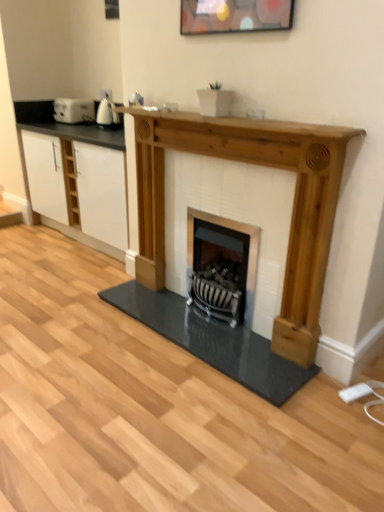
I want to click on wooden shelf at center, so click(65, 125).

What are the coordinates of `natural wood fireplace at center` in the screenshot? It's located at (238, 282).

Identify the location of white glossy kettle at upper left, arranged as the first appliance when viewed from the right. This screenshot has width=384, height=512. (107, 113).

Where is `wooden shelf at center`? The width and height of the screenshot is (384, 512). wooden shelf at center is located at coordinates (65, 125).

Can we say white glossy kettle at upper left, the second appliance when ordered from back to front, lies outside white plastic toaster at left, which ranks as the second appliance in right-to-left order?

Yes.

Between white glossy kettle at upper left, the second appliance when ordered from back to front, and white plastic toaster at left, which is the 1th appliance from left to right, which one has more height?

Standing taller between the two is white glossy kettle at upper left, the second appliance when ordered from back to front.

From the image's perspective, is white glossy kettle at upper left, the 1th appliance positioned from the front, under white plastic toaster at left, which is the 1th appliance from left to right?

Indeed, from the image's perspective, white glossy kettle at upper left, the 1th appliance positioned from the front, is shown beneath white plastic toaster at left, which is the 1th appliance from left to right.

Image resolution: width=384 pixels, height=512 pixels. Identify the location of appliance below the white glossy kettle at upper left, the second appliance when ordered from back to front (from a real-world perspective). (74, 110).

Is white glossy kettle at upper left, the second appliance when ordered from back to front, wider than natural wood fireplace at center?

No.

Which object is further away from the camera taking this photo, white glossy kettle at upper left, arranged as the first appliance when viewed from the right, or natural wood fireplace at center?

Positioned behind is white glossy kettle at upper left, arranged as the first appliance when viewed from the right.

Based on the photo, is white glossy kettle at upper left, positioned as the 2th appliance in left-to-right order, taller or shorter than natural wood fireplace at center?

Clearly, white glossy kettle at upper left, positioned as the 2th appliance in left-to-right order, is shorter compared to natural wood fireplace at center.

Are white glossy kettle at upper left, the second appliance when ordered from back to front, and natural wood fireplace at center far apart?

Indeed, white glossy kettle at upper left, the second appliance when ordered from back to front, is not near natural wood fireplace at center.

How far apart are white plastic toaster at left, which ranks as the second appliance in right-to-left order, and natural wood fireplace at center?

They are 1.86 meters apart.

Is white plastic toaster at left, which is the 1th appliance from left to right, wider or thinner than natural wood fireplace at center?

In the image, white plastic toaster at left, which is the 1th appliance from left to right, appears to be wider than natural wood fireplace at center.

From the picture: Is white plastic toaster at left, the second appliance when ordered from front to back, at the right side of natural wood fireplace at center?

No.

Can you confirm if white plastic toaster at left, which is the 1th appliance from left to right, is smaller than natural wood fireplace at center?

Yes.

What's the angular difference between white matte cabinet at center and white glossy kettle at upper left, the second appliance when ordered from back to front,'s facing directions?

The facing directions of white matte cabinet at center and white glossy kettle at upper left, the second appliance when ordered from back to front, are 2.07 degrees apart.

Which object is closer to the camera, white matte cabinet at center or white glossy kettle at upper left, arranged as the first appliance when viewed from the right?

white matte cabinet at center is closer to the camera.

From the image's perspective, is white matte cabinet at center over white glossy kettle at upper left, positioned as the 2th appliance in left-to-right order?

No, from the image's perspective, white matte cabinet at center is not above white glossy kettle at upper left, positioned as the 2th appliance in left-to-right order.

In the scene shown: Who is more distant, white matte cabinet at center or wooden shelf at center?

white matte cabinet at center is behind.

Are white matte cabinet at center and wooden shelf at center making contact?

white matte cabinet at center and wooden shelf at center are clearly separated.

Which is correct: white matte cabinet at center is inside wooden shelf at center, or outside of it?

white matte cabinet at center is located beyond the bounds of wooden shelf at center.

Does point (26, 129) appear closer or farther from the camera than point (49, 108)?

Clearly, point (26, 129) is closer to the camera than point (49, 108).

Which object is further away from the camera, wooden shelf at center or natural wood fireplace at center?

natural wood fireplace at center is more distant.

The image size is (384, 512). What are the coordinates of `fireplace below the wooden shelf at center (from the image's perspective)` in the screenshot? It's located at (238, 282).

Measure the distance between wooden shelf at center and natural wood fireplace at center.

A distance of 3.64 feet exists between wooden shelf at center and natural wood fireplace at center.

Who is taller, wooden shelf at center or natural wood fireplace at center?

With more height is natural wood fireplace at center.

Is black metal wood burning stove at center positioned beyond the bounds of white plastic toaster at left, the second appliance when ordered from front to back?

black metal wood burning stove at center is positioned outside white plastic toaster at left, the second appliance when ordered from front to back.

Is black metal wood burning stove at center shorter than white plastic toaster at left, which ranks as the second appliance in right-to-left order?

No.

Considering the sizes of objects black metal wood burning stove at center and white plastic toaster at left, acting as the first appliance starting from the back, in the image provided, who is thinner, black metal wood burning stove at center or white plastic toaster at left, acting as the first appliance starting from the back,?

Thinner between the two is black metal wood burning stove at center.

The image size is (384, 512). I want to click on appliance that appears above the white glossy kettle at upper left, the 1th appliance positioned from the front (from the image's perspective), so click(74, 110).

Identify the location of appliance that is the 1st object to the left of the natural wood fireplace at center, starting at the anchor. The width and height of the screenshot is (384, 512). pyautogui.click(x=107, y=113).

Based on their spatial positions, is white matte cabinet at center or natural wood fireplace at center further from white glossy kettle at upper left, the second appliance when ordered from back to front?

Based on the image, natural wood fireplace at center appears to be further to white glossy kettle at upper left, the second appliance when ordered from back to front.

Which object lies further to the anchor point black metal wood burning stove at center, white plastic toaster at left, which is the 1th appliance from left to right, or wooden shelf at center?

The object further to black metal wood burning stove at center is white plastic toaster at left, which is the 1th appliance from left to right.

Considering their positions, is black metal wood burning stove at center positioned further to white matte cabinet at center than white glossy kettle at upper left, arranged as the first appliance when viewed from the right?

black metal wood burning stove at center.

Which object lies nearer to the anchor point natural wood fireplace at center, black metal wood burning stove at center or wooden shelf at center?

black metal wood burning stove at center is positioned closer to the anchor natural wood fireplace at center.

Based on their spatial positions, is white matte cabinet at center or black metal wood burning stove at center further from white plastic toaster at left, the second appliance when ordered from front to back?

black metal wood burning stove at center.

Estimate the real-world distances between objects in this image. Which object is further from white glossy kettle at upper left, the second appliance when ordered from back to front, wooden shelf at center or black metal wood burning stove at center?

Based on the image, black metal wood burning stove at center appears to be further to white glossy kettle at upper left, the second appliance when ordered from back to front.

Considering their positions, is white glossy kettle at upper left, the second appliance when ordered from back to front, positioned further to wooden shelf at center than black metal wood burning stove at center?

black metal wood burning stove at center.

Which object lies further to the anchor point natural wood fireplace at center, white plastic toaster at left, which ranks as the second appliance in right-to-left order, or wooden shelf at center?

white plastic toaster at left, which ranks as the second appliance in right-to-left order, is positioned further to the anchor natural wood fireplace at center.

Identify the location of fireplace between wooden shelf at center and black metal wood burning stove at center from top to bottom. (238, 282).

You are a GUI agent. You are given a task and a screenshot of the screen. Output one action in this format:
    pyautogui.click(x=<x>, y=<y>)
    Task: Click on the fireplace between wooden shelf at center and white plastic toaster at left, which ranks as the second appliance in right-to-left order, from front to back
    The image size is (384, 512).
    Given the screenshot: What is the action you would take?
    (x=238, y=282)

Locate an element on the screen. Image resolution: width=384 pixels, height=512 pixels. cabinetry positioned between natural wood fireplace at center and white plastic toaster at left, acting as the first appliance starting from the back, from near to far is located at coordinates (78, 186).

Locate an element on the screen. This screenshot has height=512, width=384. appliance between white matte cabinet at center and white plastic toaster at left, acting as the first appliance starting from the back, from front to back is located at coordinates (107, 113).